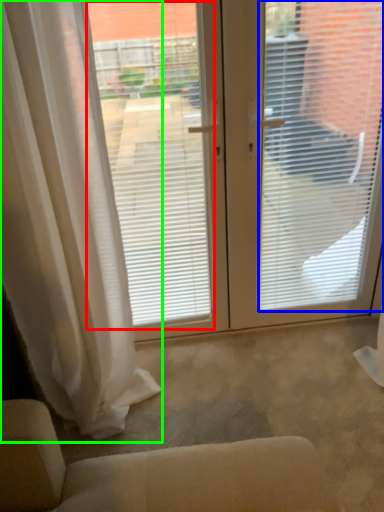
Question: Which object is the farthest from window screen (highlighted by a red box)? Choose among these: window blind (highlighted by a blue box) or curtain (highlighted by a green box).

Choices:
 (A) window blind
 (B) curtain

Answer: (A)